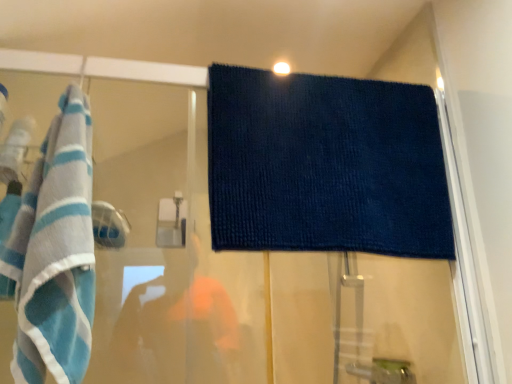
Question: From a real-world perspective, is dark blue textured towel at upper center, which is the 1th towel from right to left, physically below blue striped towel at left, which is the 2th towel from right to left?

Choices:
 (A) yes
 (B) no

Answer: (B)

Question: Can you confirm if dark blue textured towel at upper center, which appears as the 2th towel when viewed from the left, is positioned to the right of blue striped towel at left, arranged as the 1th towel when viewed from the front?

Choices:
 (A) no
 (B) yes

Answer: (B)

Question: Does dark blue textured towel at upper center, which ranks as the second towel in front-to-back order, lie in front of blue striped towel at left, the first towel positioned from the left?

Choices:
 (A) yes
 (B) no

Answer: (B)

Question: Is dark blue textured towel at upper center, which is the 1th towel from right to left, aimed at blue striped towel at left, which ranks as the 2th towel in back-to-front order?

Choices:
 (A) yes
 (B) no

Answer: (B)

Question: Is the position of dark blue textured towel at upper center, which ranks as the second towel in front-to-back order, more distant than that of blue striped towel at left, which is the 2th towel from right to left?

Choices:
 (A) no
 (B) yes

Answer: (B)

Question: Is dark blue textured towel at upper center, which appears as the 2th towel when viewed from the left, turned away from blue striped towel at left, which is the 2th towel from right to left?

Choices:
 (A) no
 (B) yes

Answer: (A)

Question: Is blue striped towel at left, which ranks as the 2th towel in back-to-front order, located outside dark blue textured towel at upper center, which is the 1th towel from right to left?

Choices:
 (A) no
 (B) yes

Answer: (B)

Question: Could you tell me if blue striped towel at left, which is the 2th towel from right to left, is turned towards dark blue textured towel at upper center, which ranks as the second towel in front-to-back order?

Choices:
 (A) yes
 (B) no

Answer: (B)

Question: Is blue striped towel at left, which ranks as the 2th towel in back-to-front order, taller than dark blue textured towel at upper center, which appears as the 2th towel when viewed from the left?

Choices:
 (A) yes
 (B) no

Answer: (A)

Question: Is blue striped towel at left, which ranks as the 2th towel in back-to-front order, in front of dark blue textured towel at upper center, which appears as the 2th towel when viewed from the left?

Choices:
 (A) no
 (B) yes

Answer: (B)

Question: Is blue striped towel at left, which ranks as the 2th towel in back-to-front order, smaller than dark blue textured towel at upper center, which is the 1th towel from right to left?

Choices:
 (A) yes
 (B) no

Answer: (B)

Question: Is blue striped towel at left, which ranks as the 2th towel in back-to-front order, far from dark blue textured towel at upper center, the first towel positioned from the back?

Choices:
 (A) yes
 (B) no

Answer: (B)

Question: Is blue striped towel at left, the first towel positioned from the left, situated inside dark blue textured towel at upper center, which appears as the 2th towel when viewed from the left, or outside?

Choices:
 (A) inside
 (B) outside

Answer: (B)